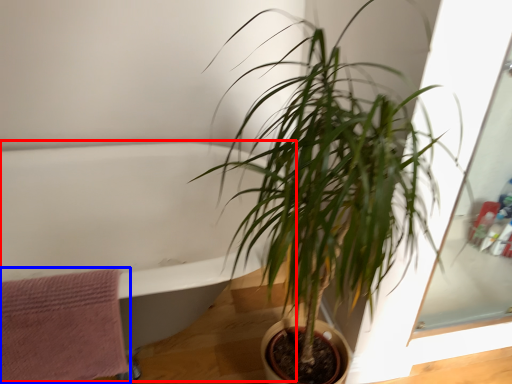
Question: Which point is further to the camera, bath (highlighted by a red box) or bath towel (highlighted by a blue box)?

Choices:
 (A) bath
 (B) bath towel

Answer: (B)